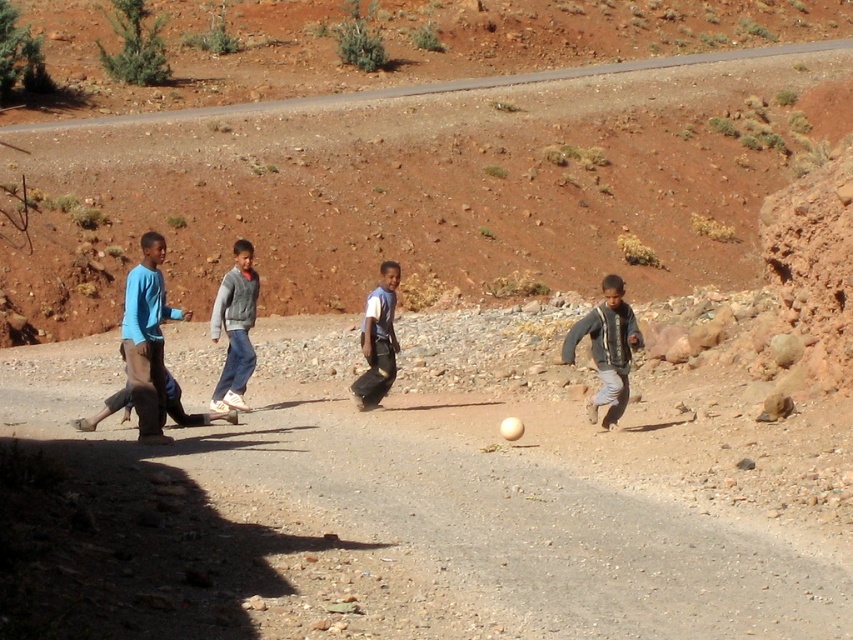
Question: Among these objects, which one is nearest to the camera?

Choices:
 (A) white matte shirt at center
 (B) gray fleece jacket at center
 (C) gray textured jacket at right

Answer: (C)

Question: Which point is closer to the camera taking this photo?

Choices:
 (A) (616, 323)
 (B) (392, 384)

Answer: (A)

Question: Among these objects, which one is nearest to the camera?

Choices:
 (A) gray fleece jacket at center
 (B) brown gravel road at center
 (C) white matte shirt at center
 (D) blue matte shirt at center

Answer: (B)

Question: Is the position of blue matte shirt at center more distant than that of gray fleece jacket at center?

Choices:
 (A) yes
 (B) no

Answer: (B)

Question: Does brown gravel road at center have a greater width compared to gray fleece jacket at center?

Choices:
 (A) no
 (B) yes

Answer: (B)

Question: Can you confirm if brown gravel road at center is wider than white matte shirt at center?

Choices:
 (A) yes
 (B) no

Answer: (A)